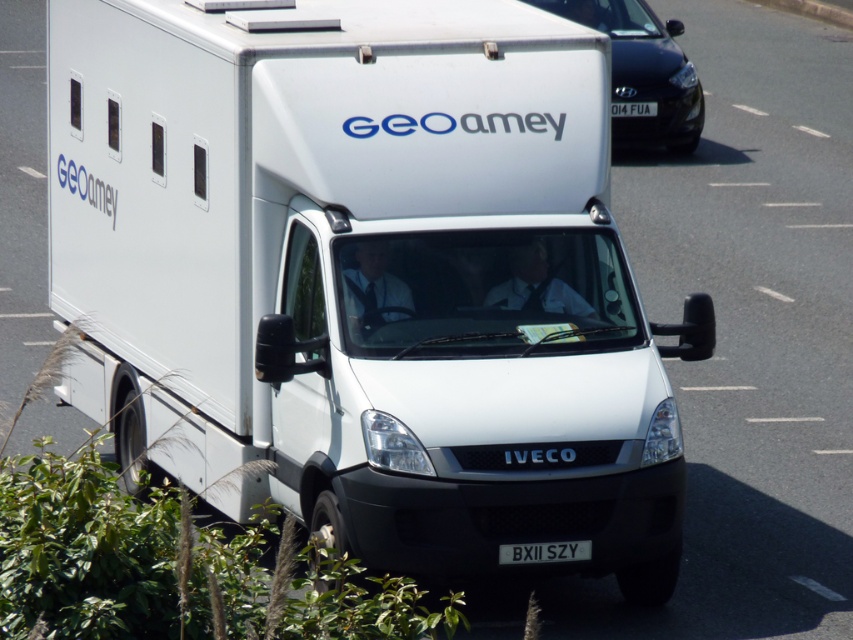
In the scene shown: How far apart are black glossy car at upper right and white plastic license plate at center?

1.03 meters

Does black glossy car at upper right have a lesser width compared to white plastic license plate at center?

Incorrect, black glossy car at upper right's width is not less than white plastic license plate at center's.

Is point (689, 93) behind point (641, 115)?

Yes, point (689, 93) is behind point (641, 115).

Find the location of `black glossy car at upper right`. black glossy car at upper right is located at coordinates (643, 72).

Is black plastic license plate at center wider than white plastic license plate at center?

Yes, black plastic license plate at center is wider than white plastic license plate at center.

Between black plastic license plate at center and white plastic license plate at center, which one has less height?

black plastic license plate at center

Is point (566, 552) positioned behind point (654, 109)?

No, (566, 552) is closer to viewer.

You are a GUI agent. You are given a task and a screenshot of the screen. Output one action in this format:
    pyautogui.click(x=<x>, y=<y>)
    Task: Click on the black plastic license plate at center
    This screenshot has width=853, height=640.
    Given the screenshot: What is the action you would take?
    pyautogui.click(x=544, y=552)

Does point (642, 52) come closer to viewer compared to point (518, 550)?

No, it is not.

Which is in front, point (630, 131) or point (556, 560)?

Point (556, 560) is in front.

Where is `black glossy car at upper right`? black glossy car at upper right is located at coordinates (643, 72).